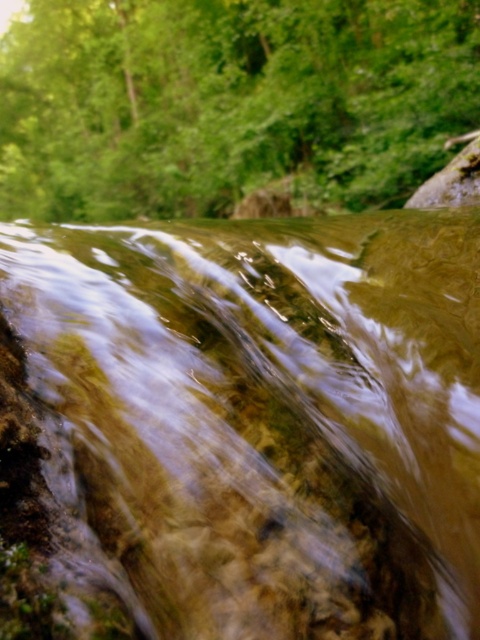
Is clear water at center shorter than green leafy tree at upper center?

Indeed, clear water at center has a lesser height compared to green leafy tree at upper center.

Between clear water at center and green leafy tree at upper center, which one is positioned higher?

green leafy tree at upper center is higher up.

Who is more distant from viewer, [78,346] or [105,172]?

Positioned behind is point [105,172].

Identify the location of clear water at center. This screenshot has width=480, height=640. (240, 428).